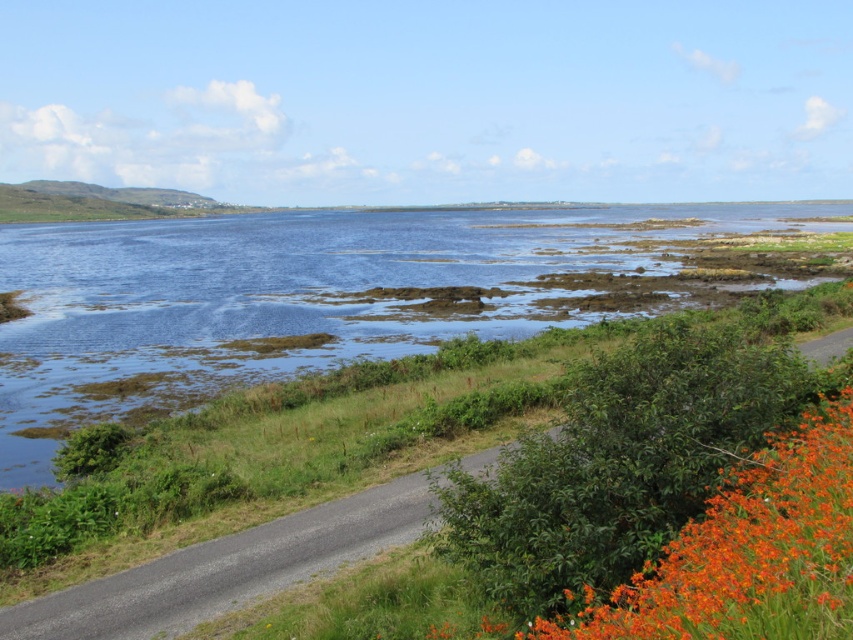
Is point (492, 264) positioned before point (761, 616)?

No.

Is blue water at center thinner than orange matte flowers at lower right?

No, blue water at center is not thinner than orange matte flowers at lower right.

I want to click on blue water at center, so [x=314, y=296].